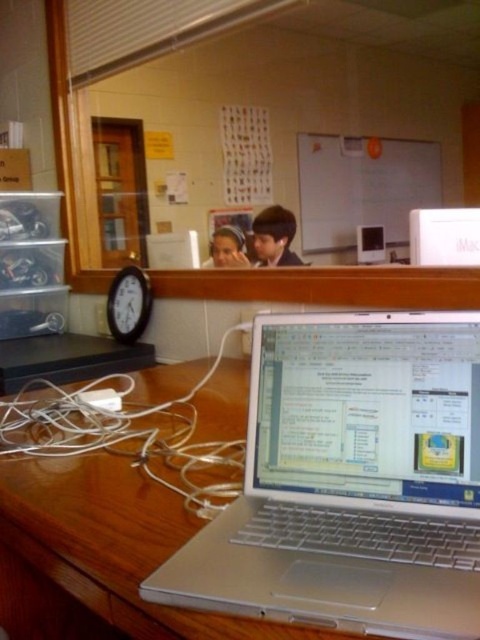
Looking at this image, does silver metallic imac at center have a lesser width compared to wooden clock at left?

Correct, silver metallic imac at center's width is less than wooden clock at left's.

Is point (432, 244) farther from camera compared to point (113, 289)?

That is False.

Where is `silver metallic imac at center`? The image size is (480, 640). silver metallic imac at center is located at coordinates (444, 236).

Does silver metallic laptop at center lie in front of wooden clock at left?

Yes, silver metallic laptop at center is closer to the viewer.

Locate an element on the screen. This screenshot has height=640, width=480. silver metallic laptop at center is located at coordinates (350, 481).

Where is `silver metallic laptop at center`? silver metallic laptop at center is located at coordinates (350, 481).

Which is behind, point (437, 516) or point (478, 243)?

Point (478, 243)

The height and width of the screenshot is (640, 480). I want to click on silver metallic laptop at center, so click(x=350, y=481).

This screenshot has height=640, width=480. Identify the location of silver metallic laptop at center. (350, 481).